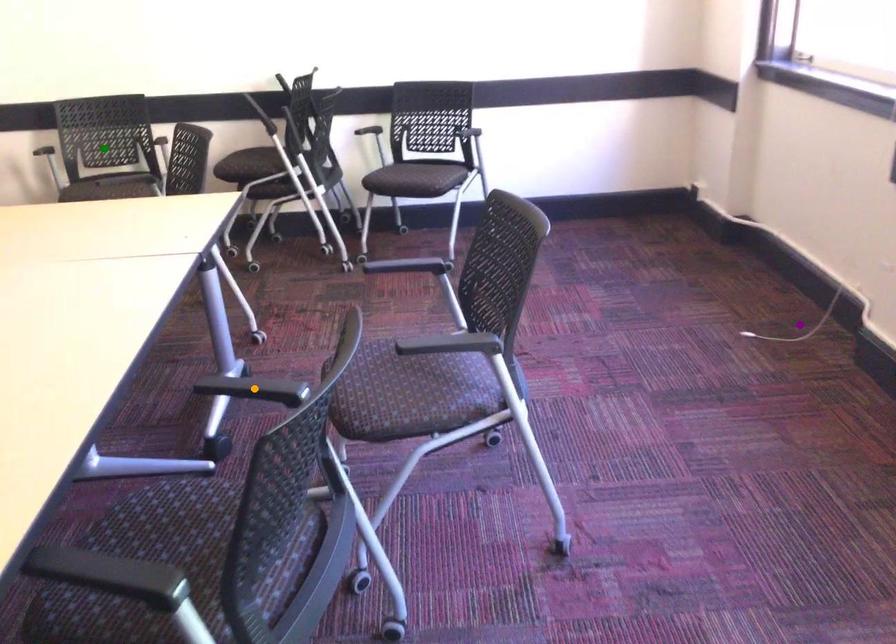
Order these from nearest to farthest:
1. green point
2. orange point
3. purple point

orange point < purple point < green point